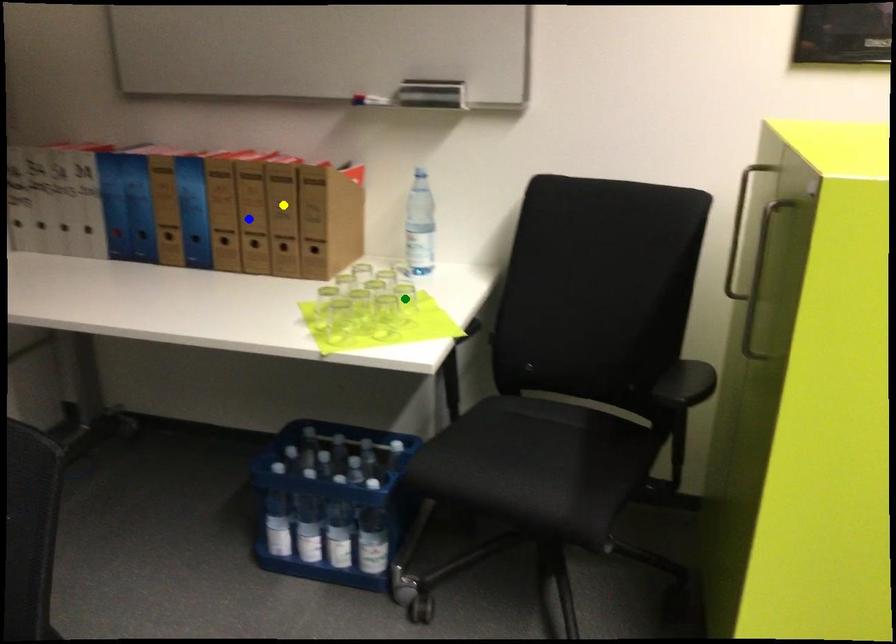
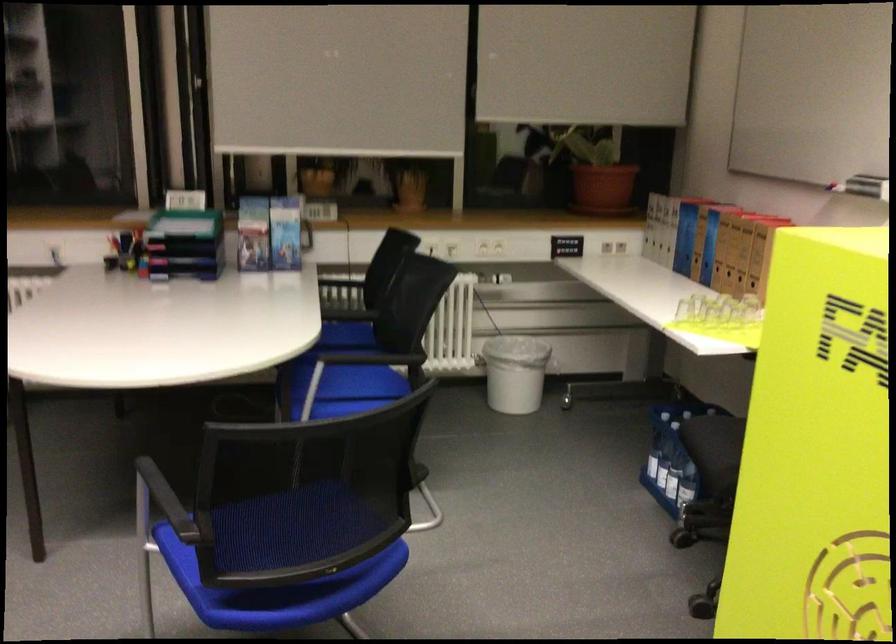
I am providing you with two images of the same scene from different viewpoints. Three points are marked in image1. Which point corresponds to a part or object that is occluded in image2?In image1, three points are marked. Which of them correspond to a part or object that is occluded in image2?Among the three points shown in image1, which one corresponds to a part or object that is no longer visible due to occlusion in image2?

green point